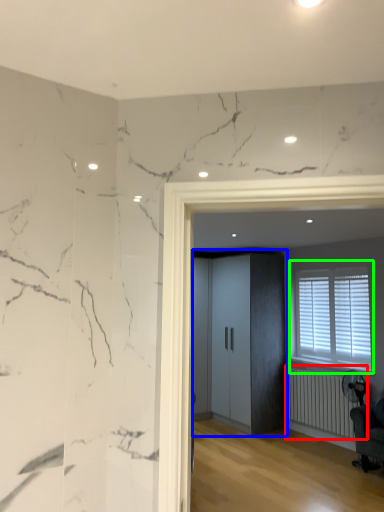
Question: Which object is the farthest from radiator (highlighted by a red box)? Choose among these: elevator (highlighted by a blue box) or window (highlighted by a green box).

Choices:
 (A) elevator
 (B) window

Answer: (A)